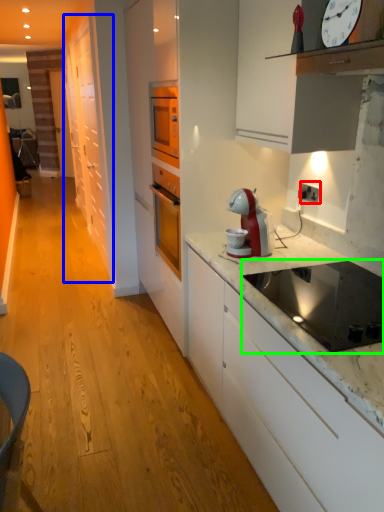
Question: Which object is positioned closest to electric outlet (highlighted by a red box)? Select from cabinetry (highlighted by a blue box) and kitchen appliance (highlighted by a green box).

Choices:
 (A) cabinetry
 (B) kitchen appliance

Answer: (B)